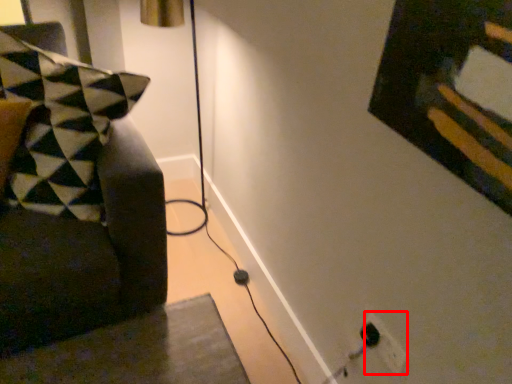
Question: From the image's perspective, where is electric outlet (annotated by the red box) located relative to furniture?

Choices:
 (A) above
 (B) below

Answer: (B)